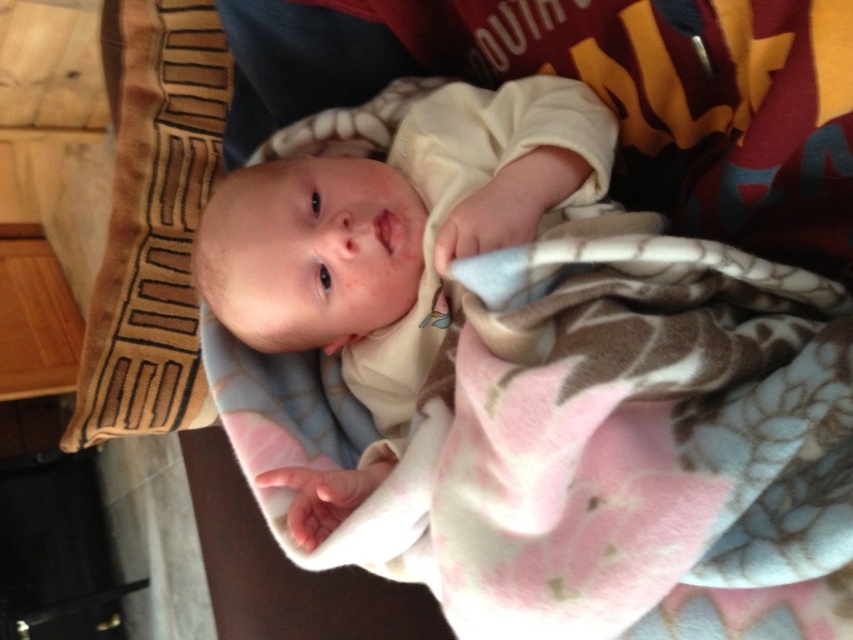
Is point (399, 288) positioned behind point (160, 298)?

No, (399, 288) is closer to viewer.

Measure the distance from smooth beige baby at center to brown textured pillow at left.

They are 18.90 inches apart.

Where is `smooth beige baby at center`? This screenshot has width=853, height=640. smooth beige baby at center is located at coordinates (387, 240).

Locate an element on the screen. This screenshot has height=640, width=853. smooth beige baby at center is located at coordinates (387, 240).